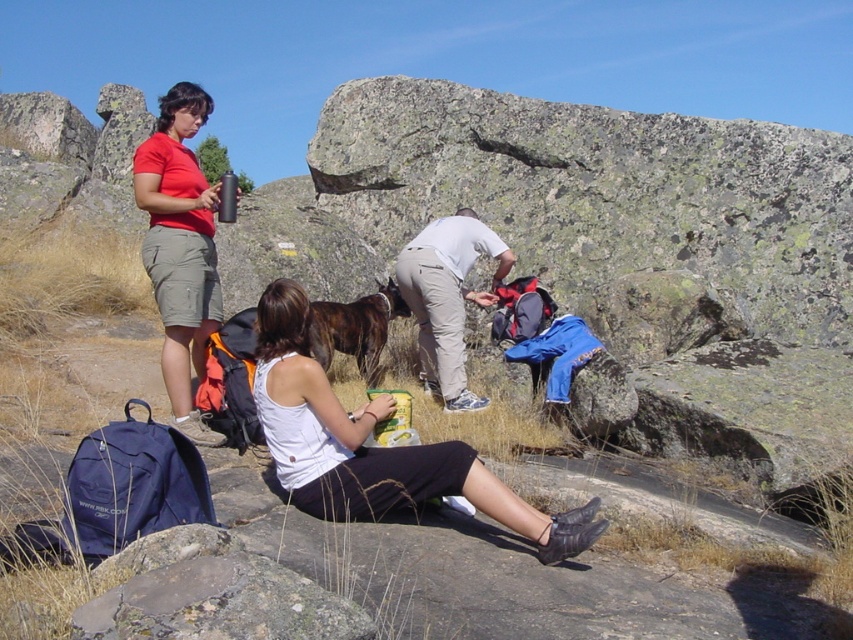
Question: From the image, what is the correct spatial relationship of white fabric tank top at center in relation to white matte shirt at center?

Choices:
 (A) left
 (B) right

Answer: (A)

Question: In this image, where is white fabric tank top at center located relative to white matte shirt at center?

Choices:
 (A) above
 (B) below

Answer: (B)

Question: Which point is closer to the camera taking this photo?

Choices:
 (A) (369, 460)
 (B) (445, 284)

Answer: (A)

Question: Is matte red shirt at left wider than white matte shirt at center?

Choices:
 (A) yes
 (B) no

Answer: (A)

Question: Which is nearer to the white fabric tank top at center?

Choices:
 (A) white matte shirt at center
 (B) matte red shirt at left

Answer: (B)

Question: Estimate the real-world distances between objects in this image. Which object is closer to the white fabric tank top at center?

Choices:
 (A) white matte shirt at center
 (B) matte red shirt at left

Answer: (B)